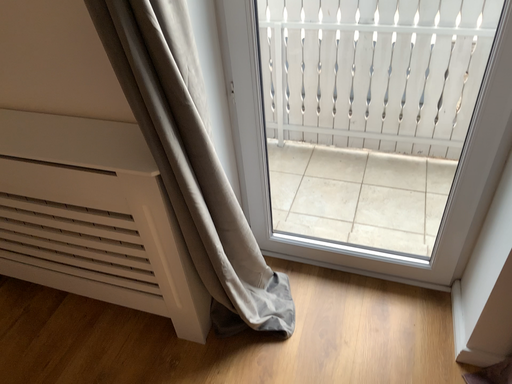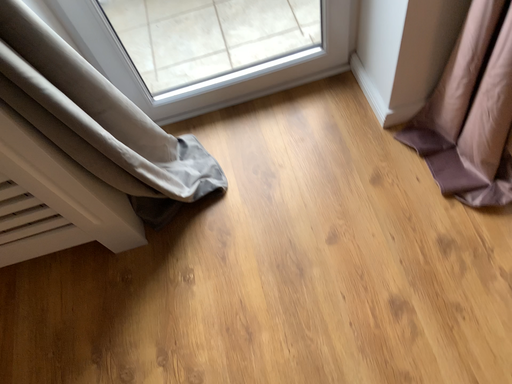
Question: How did the camera likely rotate when shooting the video?

Choices:
 (A) rotated left
 (B) rotated right

Answer: (B)